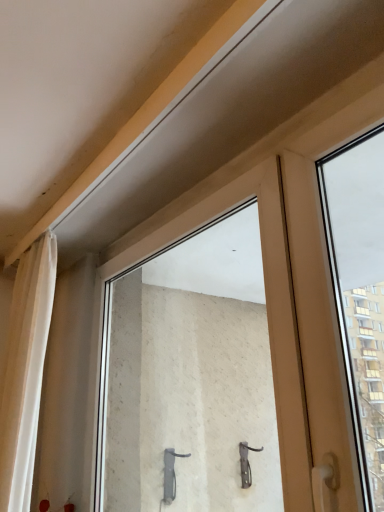
Question: Is transparent glass window at center at the right side of white sheer curtain at left?

Choices:
 (A) yes
 (B) no

Answer: (A)

Question: Is the depth of transparent glass window at center less than that of white sheer curtain at left?

Choices:
 (A) no
 (B) yes

Answer: (B)

Question: Is transparent glass window at center shorter than white sheer curtain at left?

Choices:
 (A) yes
 (B) no

Answer: (A)

Question: From the image's perspective, is transparent glass window at center under white sheer curtain at left?

Choices:
 (A) no
 (B) yes

Answer: (A)

Question: From a real-world perspective, is transparent glass window at center located beneath white sheer curtain at left?

Choices:
 (A) yes
 (B) no

Answer: (A)

Question: Considering the relative positions of transparent glass window at center and white sheer curtain at left in the image provided, is transparent glass window at center to the left of white sheer curtain at left from the viewer's perspective?

Choices:
 (A) no
 (B) yes

Answer: (A)

Question: Does white sheer curtain at left have a greater height compared to transparent glass window at center?

Choices:
 (A) yes
 (B) no

Answer: (A)

Question: Is white sheer curtain at left placed right next to transparent glass window at center?

Choices:
 (A) yes
 (B) no

Answer: (B)

Question: From a real-world perspective, does white sheer curtain at left sit lower than transparent glass window at center?

Choices:
 (A) no
 (B) yes

Answer: (A)

Question: Does white sheer curtain at left have a smaller size compared to transparent glass window at center?

Choices:
 (A) yes
 (B) no

Answer: (A)

Question: Is white sheer curtain at left at the left side of transparent glass window at center?

Choices:
 (A) no
 (B) yes

Answer: (B)

Question: Considering the relative sizes of white sheer curtain at left and transparent glass window at center in the image provided, is white sheer curtain at left bigger than transparent glass window at center?

Choices:
 (A) yes
 (B) no

Answer: (B)

Question: Based on their positions, is white sheer curtain at left located to the left or right of transparent glass window at center?

Choices:
 (A) right
 (B) left

Answer: (B)